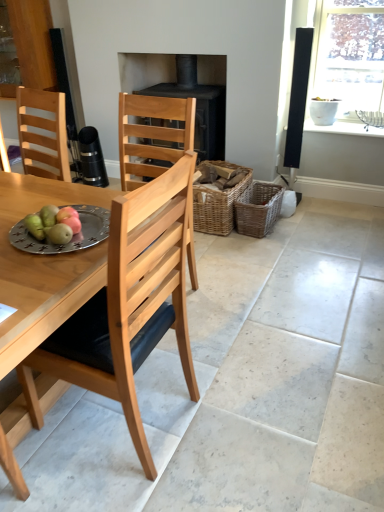
Find the location of a particular element. The height and width of the screenshot is (512, 384). vacant space situated above silver metallic plate at table left (from a real-world perspective) is located at coordinates (59, 230).